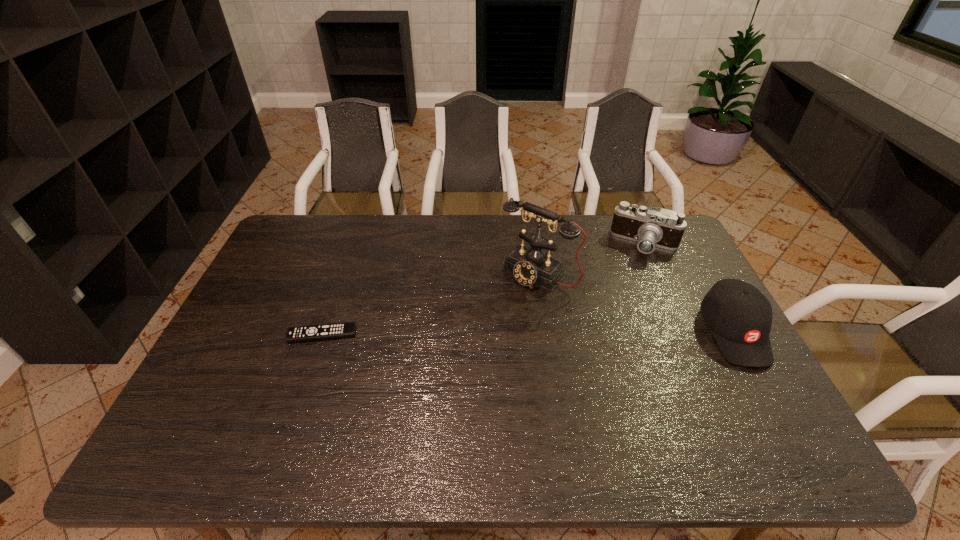
Locate an element on the screen. Image resolution: width=960 pixels, height=540 pixels. free region located on the dial of the tallest object is located at coordinates (460, 352).

Identify the location of vacant space located 0.180m at the lens of the camera. (614, 289).

This screenshot has width=960, height=540. Find the location of `free location located at the lens of the camera`. free location located at the lens of the camera is located at coordinates (605, 305).

Find the location of a particular element. This screenshot has height=540, width=960. vacant area situated at the lens of the camera is located at coordinates (591, 325).

This screenshot has height=540, width=960. I want to click on object at the far edge, so click(651, 227).

Identify the location of baseball cap that is at the right edge. (739, 316).

Find the location of a particular element. The width and height of the screenshot is (960, 540). camera that is at the right edge is located at coordinates (651, 227).

I want to click on object situated at the far right corner, so click(651, 227).

In the image, there is a desktop. Where is `vacant space at the far edge`? The height and width of the screenshot is (540, 960). vacant space at the far edge is located at coordinates (573, 251).

Locate an element on the screen. The height and width of the screenshot is (540, 960). free region at the near edge of the desktop is located at coordinates (419, 420).